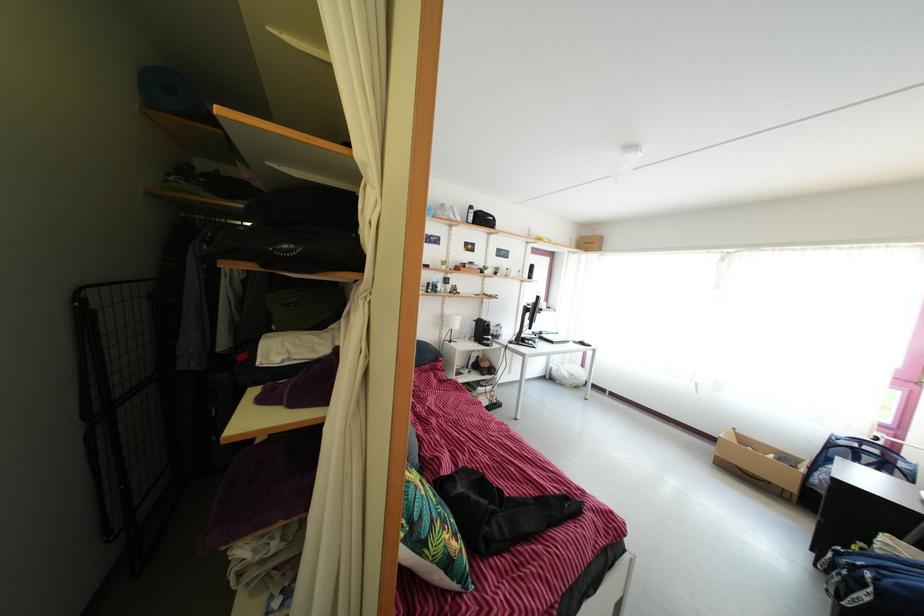
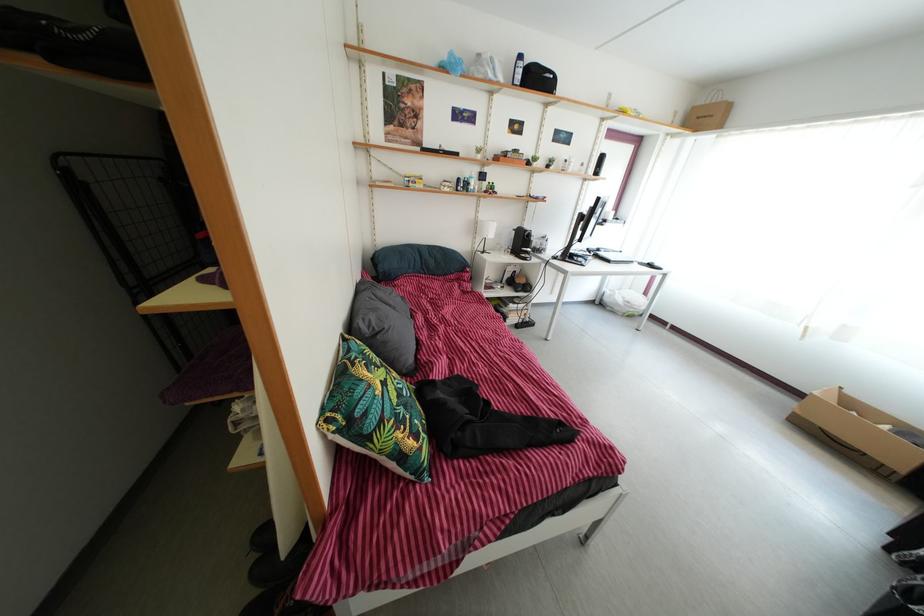
Question: How did the camera likely rotate?

Choices:
 (A) Left
 (B) Right
 (C) Up
 (D) Down

Answer: (D)